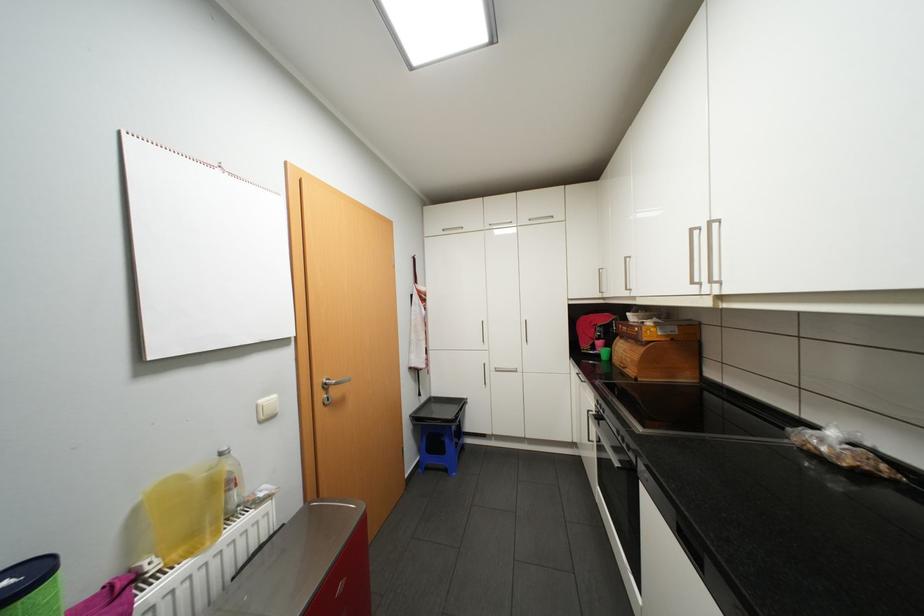
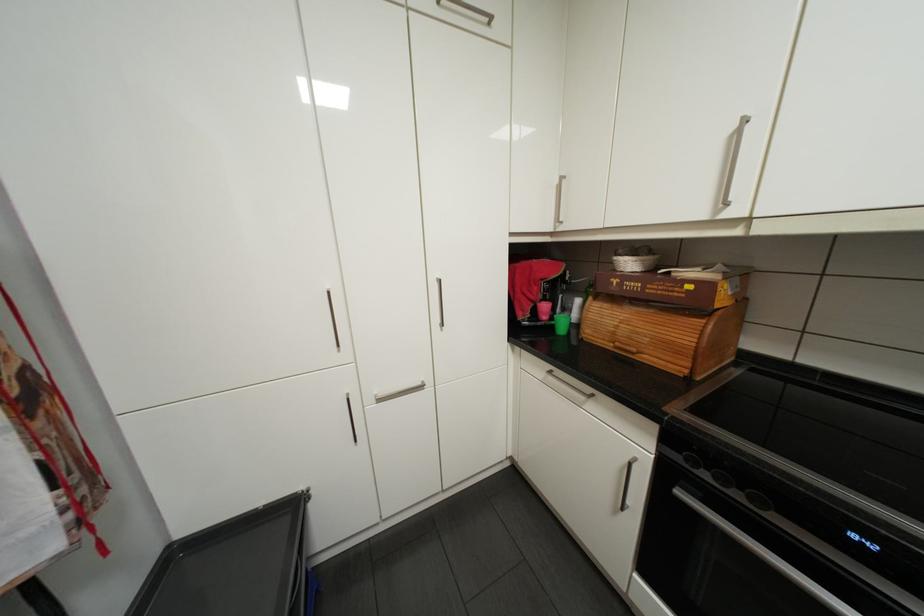
The point at (652,338) is marked in the first image. Where is the corresponding point in the second image?

(725, 305)